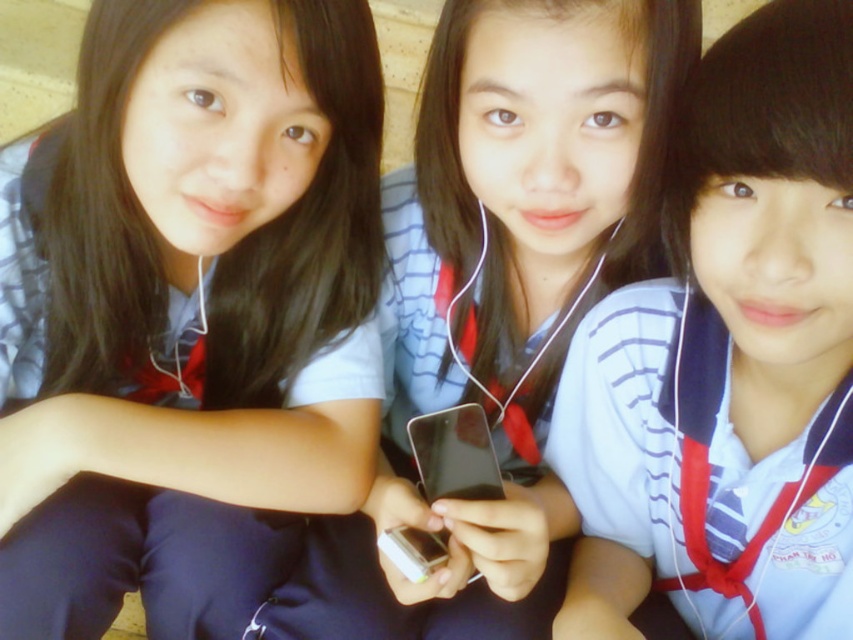
Who is lower down, blue striped shirt at center or black glossy smartphone at center?

black glossy smartphone at center

What do you see at coordinates (728, 360) in the screenshot?
I see `blue striped shirt at center` at bounding box center [728, 360].

The width and height of the screenshot is (853, 640). What are the coordinates of `blue striped shirt at center` in the screenshot? It's located at (728, 360).

Locate an element on the screen. This screenshot has height=640, width=853. blue striped shirt at center is located at coordinates (728, 360).

Between blue striped shirt at center and matte black phone at center, which one has less height?

With less height is blue striped shirt at center.

Is blue striped shirt at center above matte black phone at center?

Incorrect, blue striped shirt at center is not positioned above matte black phone at center.

Who is more forward, [679,611] or [316,577]?

Point [316,577] is more forward.

The height and width of the screenshot is (640, 853). Identify the location of blue striped shirt at center. (728, 360).

Does matte black phone at center have a smaller size compared to black glossy smartphone at center?

No, matte black phone at center is not smaller than black glossy smartphone at center.

Is point (543, 561) positioned in front of point (482, 461)?

No, it is not.

I want to click on matte black phone at center, so click(x=498, y=294).